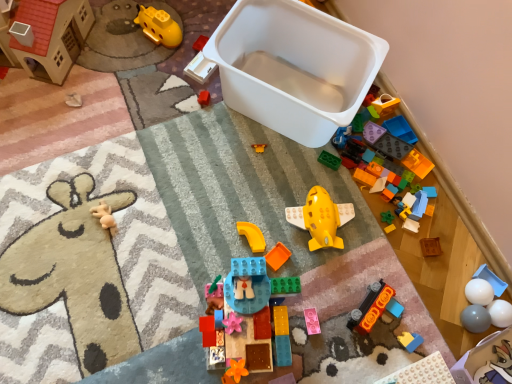
Where is `free space between yellow plastic submarine at upper left, which appears as the third toy when viewed from the left, and pink matte block at center, the tenth toy positioned from the right`? This screenshot has height=384, width=512. free space between yellow plastic submarine at upper left, which appears as the third toy when viewed from the left, and pink matte block at center, the tenth toy positioned from the right is located at coordinates (221, 155).